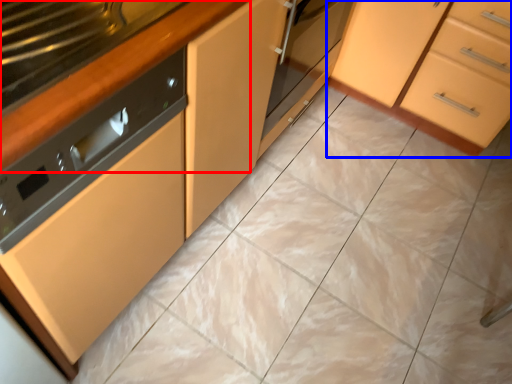
Question: Which point is further to the camera, counter top (highlighted by a red box) or cabinetry (highlighted by a blue box)?

Choices:
 (A) counter top
 (B) cabinetry

Answer: (B)